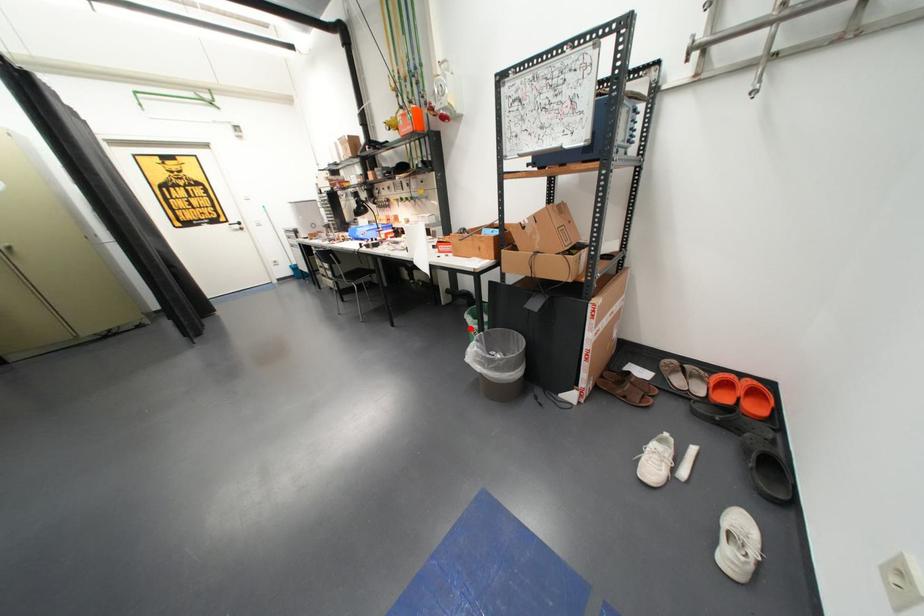
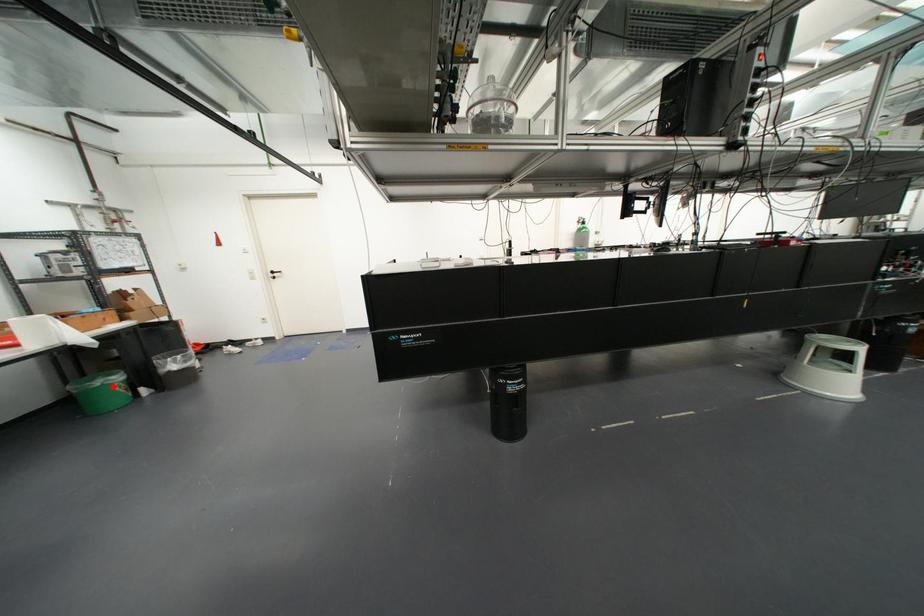
I am providing you with two images of the same scene from different viewpoints. A red point is marked on the first image and another point is marked on the second image. Do the highlighted points in image1 and image2 indicate the same real-world spot?

Yes